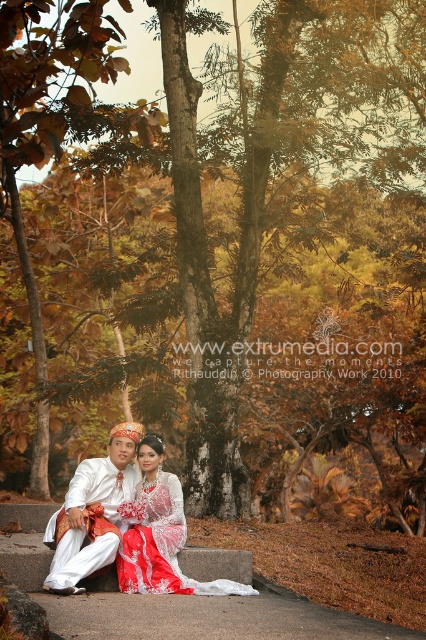
Question: Which point is farther to the camera?

Choices:
 (A) (141, 497)
 (B) (71, 573)

Answer: (A)

Question: Observing the image, what is the correct spatial positioning of white satin suit at center in reference to white lace dress at center?

Choices:
 (A) above
 (B) below

Answer: (A)

Question: Is white satin suit at center closer to the viewer compared to white lace dress at center?

Choices:
 (A) yes
 (B) no

Answer: (A)

Question: Which point is closer to the camera?

Choices:
 (A) (94, 561)
 (B) (143, 486)

Answer: (A)

Question: Is white satin suit at center wider than white lace dress at center?

Choices:
 (A) no
 (B) yes

Answer: (A)

Question: Which object appears farthest from the camera in this image?

Choices:
 (A) white lace dress at center
 (B) white satin suit at center

Answer: (A)